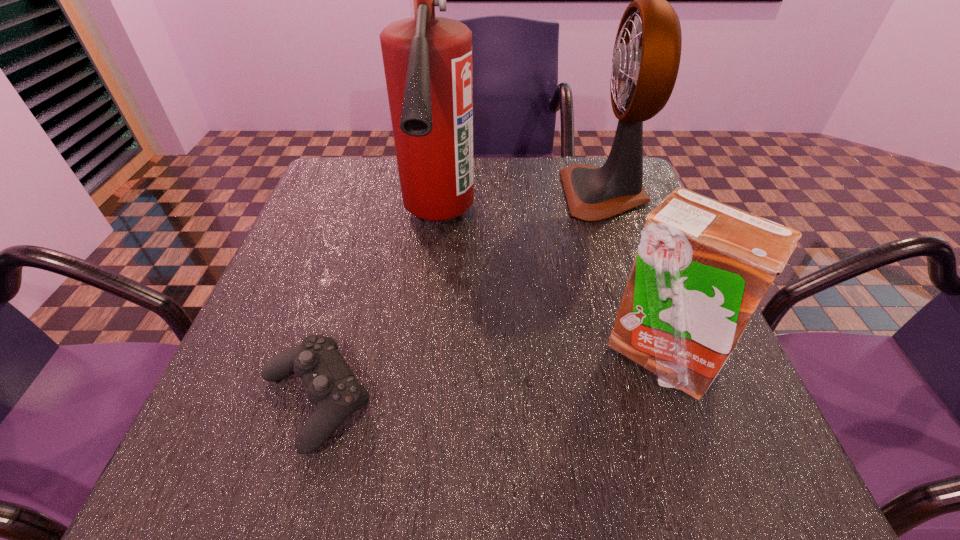
At what (x,y) coordinates should I click in order to perform the action: click on vacant area that lies between the third tallest object and the tallest object. Please return your answer as a coordinate pair (x, y). Looking at the image, I should click on (549, 288).

Point out which object is positioned as the nearest to the tallest object. Please provide its 2D coordinates. Your answer should be formatted as a tuple, i.e. [(x, y)], where the tuple contains the x and y coordinates of a point satisfying the conditions above.

[(332, 387)]

Identify which object is the second nearest to the fan. Please provide its 2D coordinates. Your answer should be formatted as a tuple, i.e. [(x, y)], where the tuple contains the x and y coordinates of a point satisfying the conditions above.

[(702, 268)]

Where is `vacant area in the image that satisfies the following two spatial constraints: 1. on the front-facing side of the fan; 2. on the straw side of the carton`? vacant area in the image that satisfies the following two spatial constraints: 1. on the front-facing side of the fan; 2. on the straw side of the carton is located at coordinates (664, 356).

Where is `free space that satisfies the following two spatial constraints: 1. on the front-facing side of the third shortest object; 2. at the nozzle of the fire extinguisher`? free space that satisfies the following two spatial constraints: 1. on the front-facing side of the third shortest object; 2. at the nozzle of the fire extinguisher is located at coordinates (614, 221).